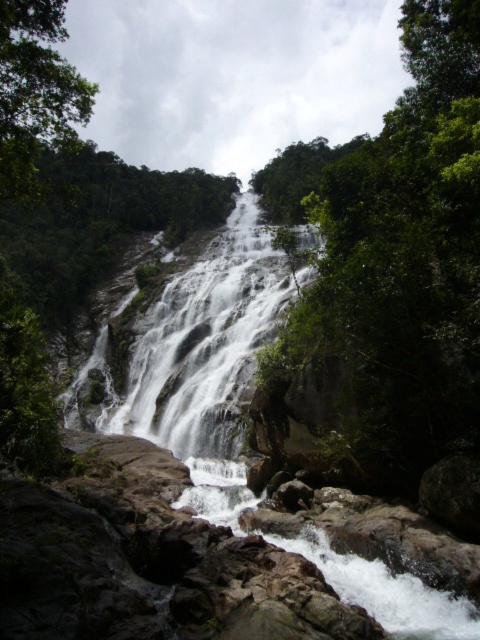
Who is more forward, (417,456) or (22,168)?

Positioned in front is point (417,456).

Which is behind, point (414, 284) or point (41, 92)?

The point (41, 92) is more distant.

At what (x,y) coordinates should I click in order to perform the action: click on green leafy tree at center. Please return your answer as a coordinate pair (x, y). Looking at the image, I should click on (405, 257).

Is point (304, 230) closer to camera compared to point (173, 348)?

No.

Which is in front, point (216, 484) or point (183, 312)?

Point (216, 484)

Find the location of `white frothy water at center`. white frothy water at center is located at coordinates (199, 362).

Does white textured waterfall at center have a greater height compared to green leafy tree at upper left?

Correct, white textured waterfall at center is much taller as green leafy tree at upper left.

Who is more forward, (175, 435) or (60, 140)?

Point (60, 140) is in front.

Who is more distant from viewer, (162, 310) or (38, 96)?

Point (162, 310)

Identify the location of white textured waterfall at center. Image resolution: width=480 pixels, height=640 pixels. (204, 342).